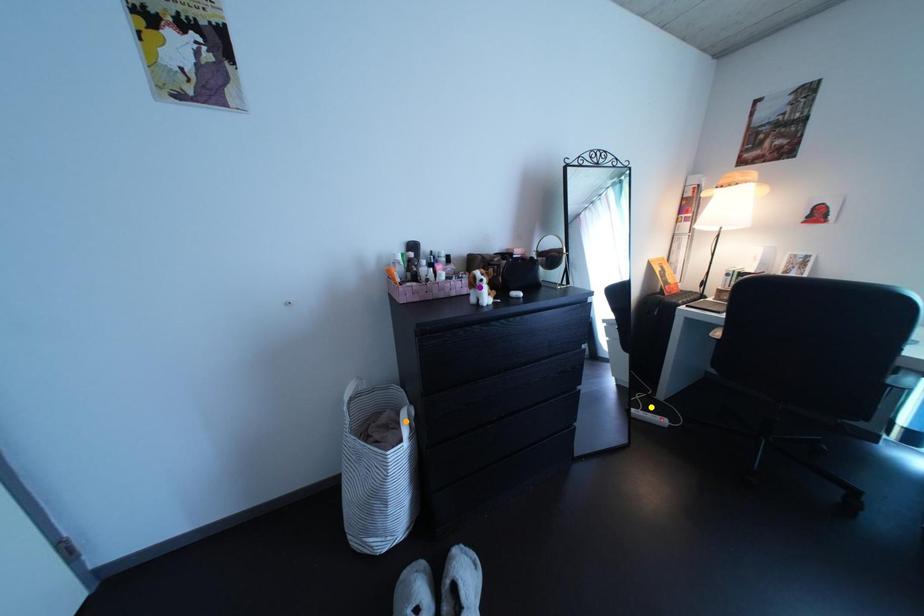
Order these from nearest to farthest:
yellow point | orange point | purple point

purple point, orange point, yellow point